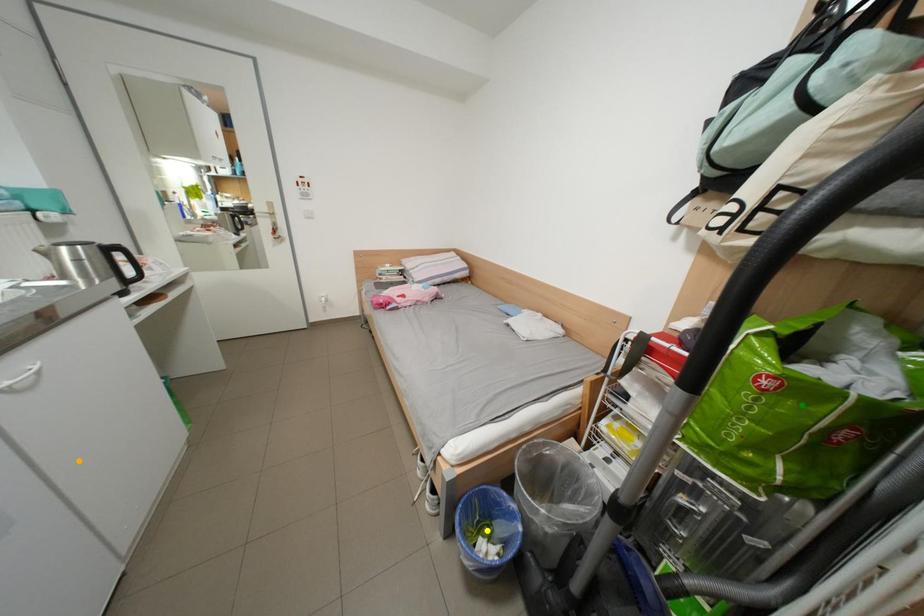
Order these from nearest to farthest:
yellow point | green point | orange point

1. orange point
2. green point
3. yellow point